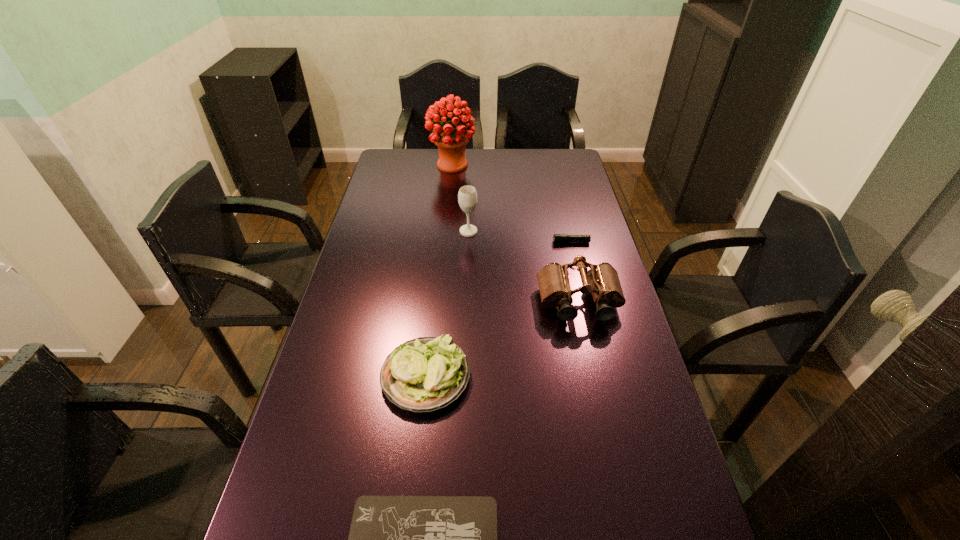
Point out which object is positioned as the third nearest to the tallest object. Please provide its 2D coordinates. Your answer should be formatted as a tuple, i.e. [(x, y)], where the tuple contains the x and y coordinates of a point satisfying the conditions above.

[(602, 280)]

Where is `free location that satisfies the following two spatial constraints: 1. at the lens end of the fourth nearest object; 2. through the eyepieces of the binoculars`? free location that satisfies the following two spatial constraints: 1. at the lens end of the fourth nearest object; 2. through the eyepieces of the binoculars is located at coordinates (586, 302).

You are a GUI agent. You are given a task and a screenshot of the screen. Output one action in this format:
    pyautogui.click(x=<x>, y=<y>)
    Task: Click on the vacant area that satisfies the following two spatial constraints: 1. at the lens end of the flashlight; 2. through the eyepieces of the binoculars
    
    Given the screenshot: What is the action you would take?
    pyautogui.click(x=586, y=302)